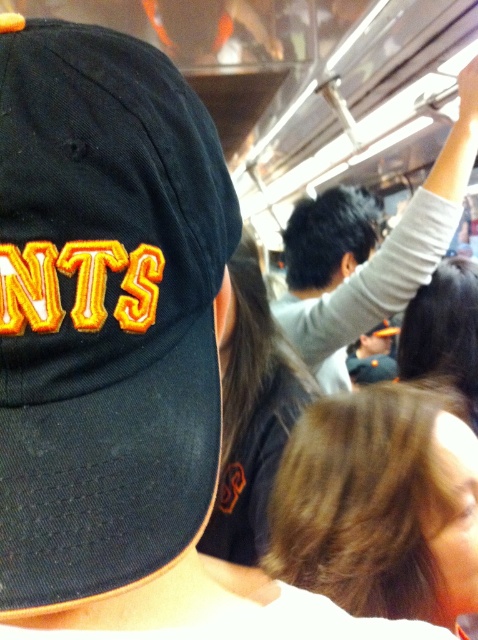
You are a passenger on a subway car and notice two people in the scene described. One has brown hair at center and another is wearing a gray fabric shirt at upper right. Which person is closer to you?

The brown hair at center is closer to you because it is positioned in front of the gray fabric shirt at upper right.

You are a photographer trying to capture a candid shot of the gray fabric shirt at upper right without getting the navy blue fabric baseball cap at left in the frame. Can you move to the right side of the scene to achieve this?

The navy blue fabric baseball cap at left is closer to the viewer than the gray fabric shirt at upper right. Moving to the right side of the scene may not eliminate the cap from the frame since it is closer and could still block the view of the shirt.

You are a passenger on a train and you see the navy blue fabric baseball cap at left and the brown hair at center. Which one is higher up?

The navy blue fabric baseball cap at left is above the brown hair at center, so it is higher up.